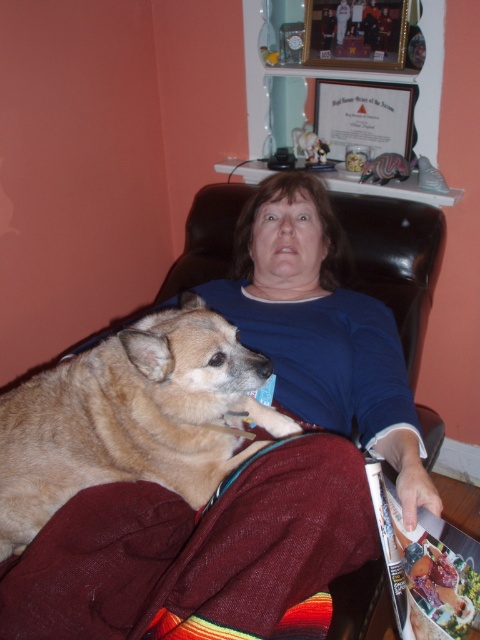
You are a photographer trying to capture the woman and the dog in the scene. Since the blue cotton shirt at upper center and the light brown fur at center are in the same area, which one is closer to the camera?

The blue cotton shirt at upper center is positioned over the light brown fur at center, so the blue cotton shirt at upper center is closer to the camera.

The woman is sitting in a black leather recliner chair. She has a light brown dog on her lap and is holding a magazine. There is a point at coordinates (195, 552). Based on the scene description, where is this point located?

The point at coordinates (195, 552) is on the burgundy fleece blanket at lower left.